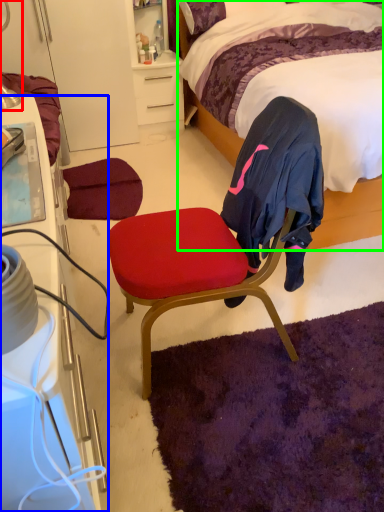
Question: Which object is positioned closest to table lamp (highlighted by a red box)? Select from cabinetry (highlighted by a blue box) and bed (highlighted by a green box).

Choices:
 (A) cabinetry
 (B) bed

Answer: (A)